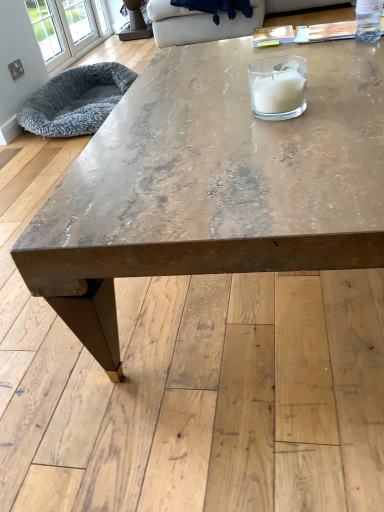
Identify the location of free space to the left of white glass candle at upper center. Image resolution: width=384 pixels, height=512 pixels. (215, 133).